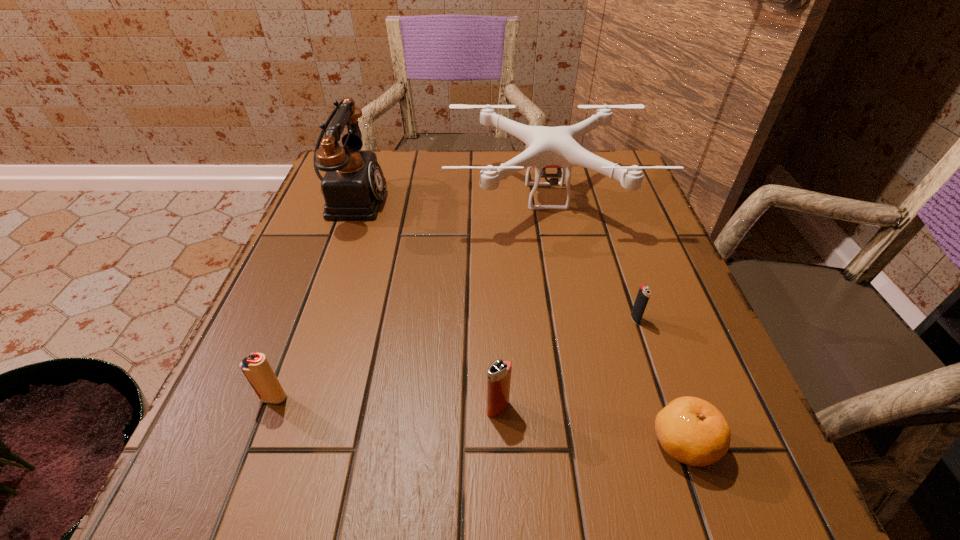
The height and width of the screenshot is (540, 960). I want to click on blank area located 0.280m on the right of the leftmost igniter, so click(x=470, y=398).

The image size is (960, 540). Identify the location of blank space located 0.160m on the back of the fourth nearest object. (613, 255).

At what (x,y) coordinates should I click in order to perform the action: click on vacant space situated on the back of the clementine. Please return your answer as a coordinate pair (x, y). The width and height of the screenshot is (960, 540). Looking at the image, I should click on (615, 245).

Find the location of a particular element. The image size is (960, 540). telephone located at the far edge is located at coordinates (353, 186).

Image resolution: width=960 pixels, height=540 pixels. Identify the location of drone that is at the far edge. (548, 147).

The image size is (960, 540). I want to click on object that is at the near edge, so click(691, 430).

This screenshot has height=540, width=960. Identify the location of telephone situated at the left edge. (353, 186).

At what (x,y) coordinates should I click in order to perform the action: click on igniter located in the left edge section of the desktop. Please return your answer as a coordinate pair (x, y). The image size is (960, 540). Looking at the image, I should click on (256, 368).

Locate an element on the screen. This screenshot has width=960, height=540. drone at the right edge is located at coordinates (548, 147).

The height and width of the screenshot is (540, 960). Identify the location of igniter that is at the right edge. (644, 292).